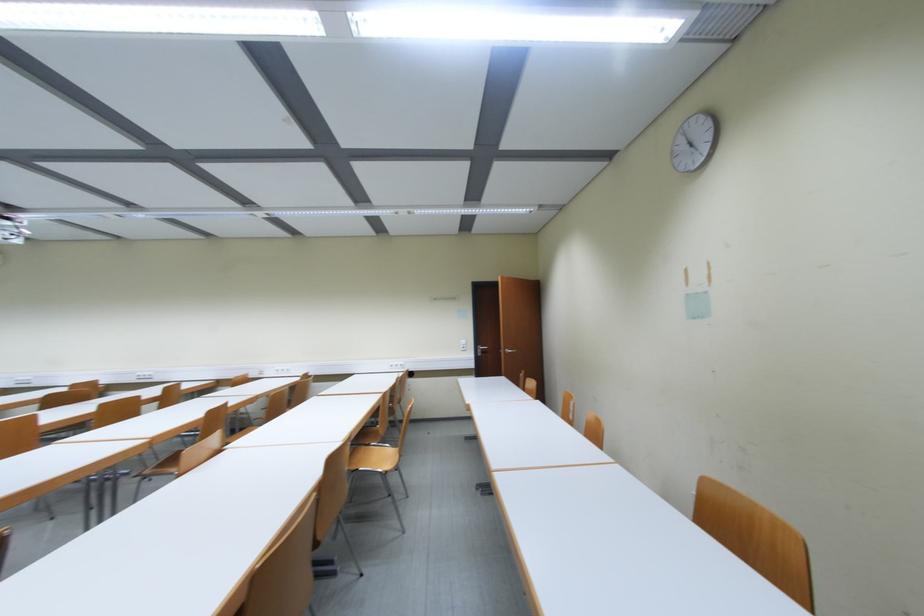
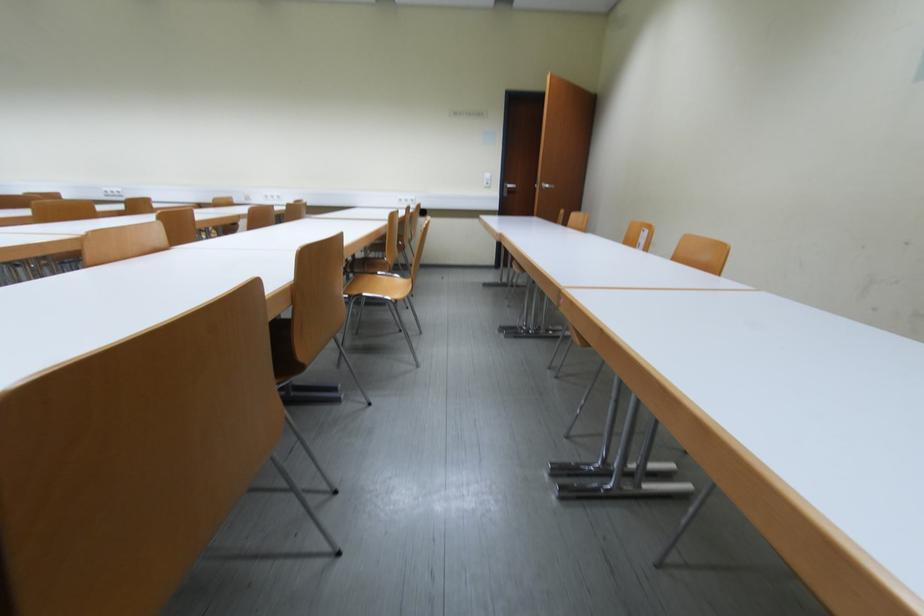
Question: The images are taken continuously from a first-person perspective. In which direction is your viewpoint rotating?

Choices:
 (A) Left
 (B) Right
 (C) Up
 (D) Down

Answer: (D)